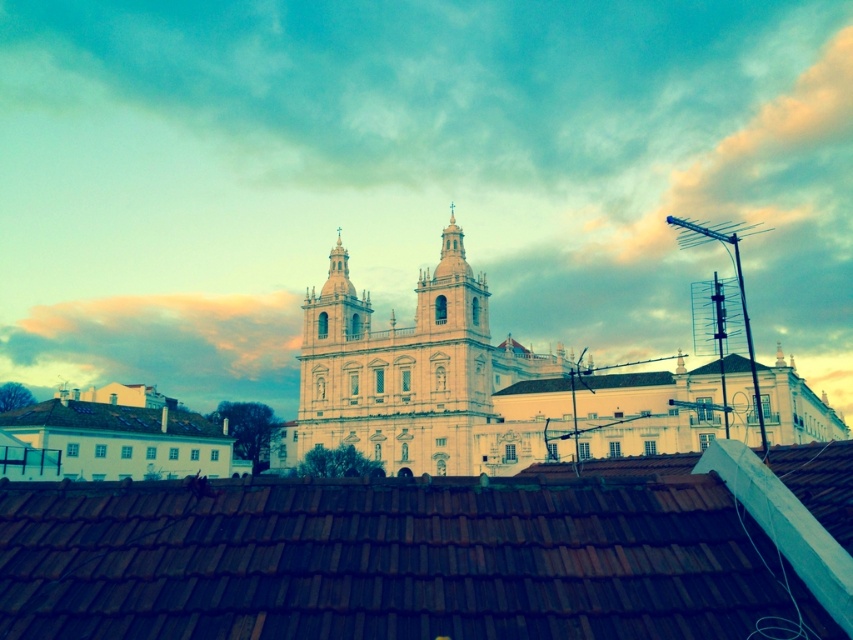
Consider the image. Can you confirm if cloudy sky at upper center is taller than brown tile roof at center?

Indeed, cloudy sky at upper center has a greater height compared to brown tile roof at center.

Which is below, cloudy sky at upper center or brown tile roof at center?

brown tile roof at center

In order to click on cloudy sky at upper center in this screenshot , I will do `click(410, 176)`.

Is point (15, 346) farther from viewer compared to point (97, 406)?

Yes, point (15, 346) is farther from viewer.

Which is below, pastel pink cloud at upper center or white shingles at lower left?

Positioned lower is white shingles at lower left.

The height and width of the screenshot is (640, 853). Describe the element at coordinates (160, 340) in the screenshot. I see `pastel pink cloud at upper center` at that location.

Identify the location of pastel pink cloud at upper center. The width and height of the screenshot is (853, 640). (160, 340).

Who is higher up, brown tile roof at center or white smooth building at lower left?

brown tile roof at center

Is brown tile roof at center positioned behind white smooth building at lower left?

No.

You are a GUI agent. You are given a task and a screenshot of the screen. Output one action in this format:
    pyautogui.click(x=<x>, y=<y>)
    Task: Click on the brown tile roof at center
    
    Given the screenshot: What is the action you would take?
    pyautogui.click(x=434, y=556)